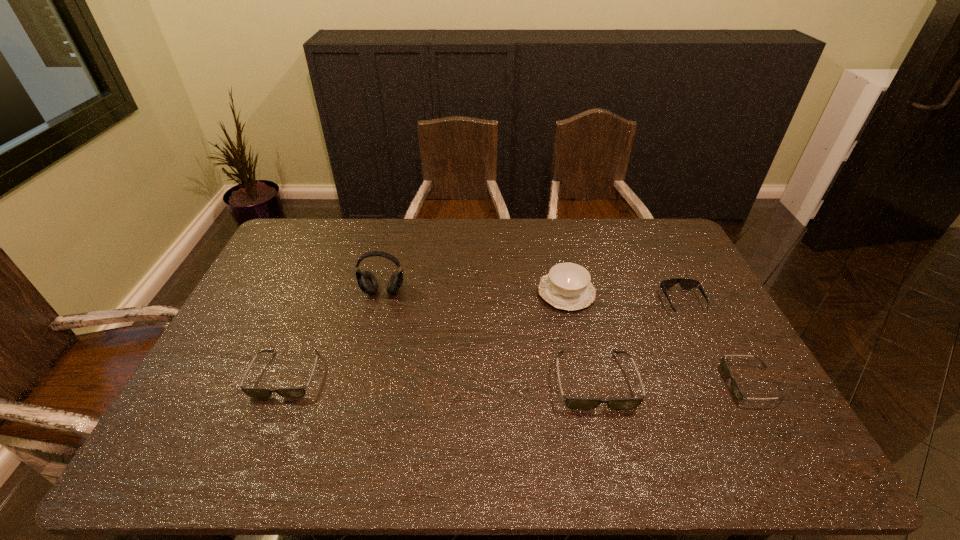
Where is `the leftmost object`? the leftmost object is located at coordinates (252, 392).

This screenshot has height=540, width=960. Find the location of `the second sunglasses from left to right`. the second sunglasses from left to right is located at coordinates (573, 403).

The height and width of the screenshot is (540, 960). In order to click on the fourth shortest object in this screenshot , I will do `click(573, 403)`.

You are a GUI agent. You are given a task and a screenshot of the screen. Output one action in this format:
    pyautogui.click(x=<x>, y=<y>)
    Task: Click on the shortest object
    The image size is (960, 540).
    Given the screenshot: What is the action you would take?
    pyautogui.click(x=739, y=395)

Identify the location of the tallest object. (367, 282).

At what (x,y) coordinates should I click in order to perform the action: click on the fifth object from right to left. Please return your answer as a coordinate pair (x, y). Looking at the image, I should click on (367, 282).

At what (x,y) coordinates should I click in order to perform the action: click on the farthest sunglasses. Please return your answer as a coordinate pair (x, y). Looking at the image, I should click on (684, 283).

Locate an element on the screen. This screenshot has width=960, height=540. chinaware is located at coordinates (567, 286).

You are a GUI agent. You are given a task and a screenshot of the screen. Output one action in this format:
    pyautogui.click(x=<x>, y=<y>)
    Task: Click on the vacant space located 0.280m on the front-facing side of the shortest sunglasses
    The width and height of the screenshot is (960, 540).
    Given the screenshot: What is the action you would take?
    pyautogui.click(x=621, y=383)

Where is `vacant point located 0.080m on the front-facing side of the shortest sunglasses`? This screenshot has width=960, height=540. vacant point located 0.080m on the front-facing side of the shortest sunglasses is located at coordinates (697, 383).